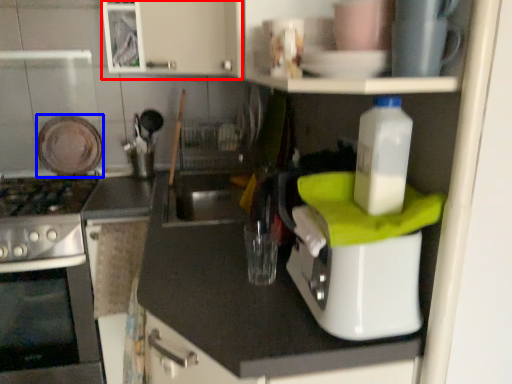
Question: Which object is closer to the camera taking this photo, cabinetry (highlighted by a red box) or appliance (highlighted by a blue box)?

Choices:
 (A) cabinetry
 (B) appliance

Answer: (A)